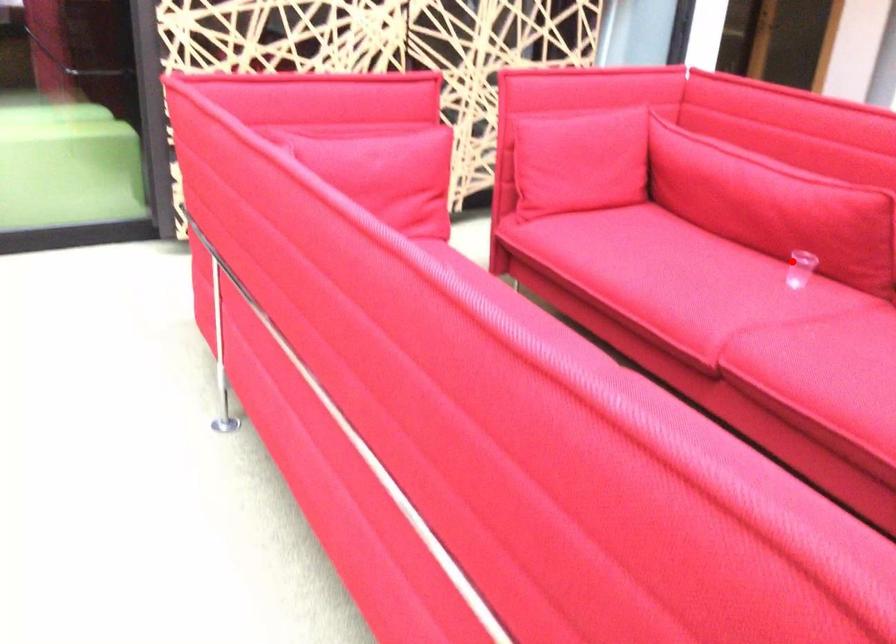
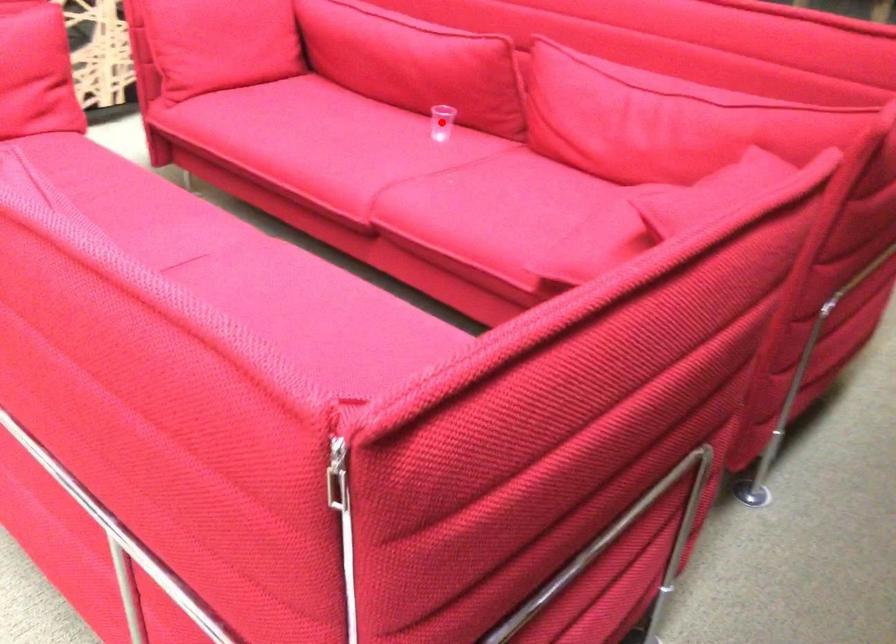
Based on the photo, I am providing you with two images of the same scene from different viewpoints. A red point is marked on the first image and another point is marked on the second image. Is the red point in image1 aligned with the point shown in image2?

Yes